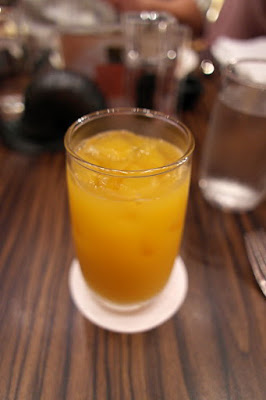
The height and width of the screenshot is (400, 266). Identify the location of glass. [123, 276].